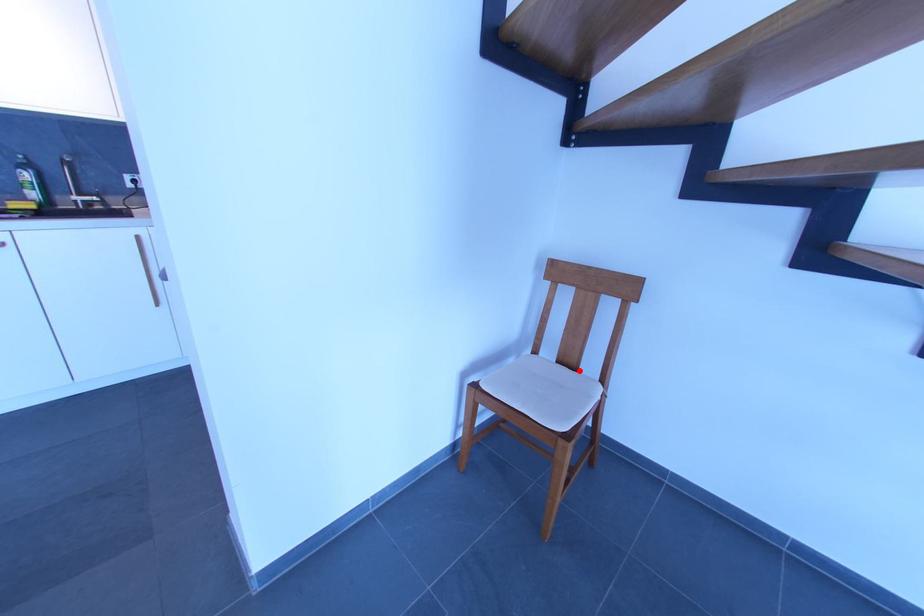
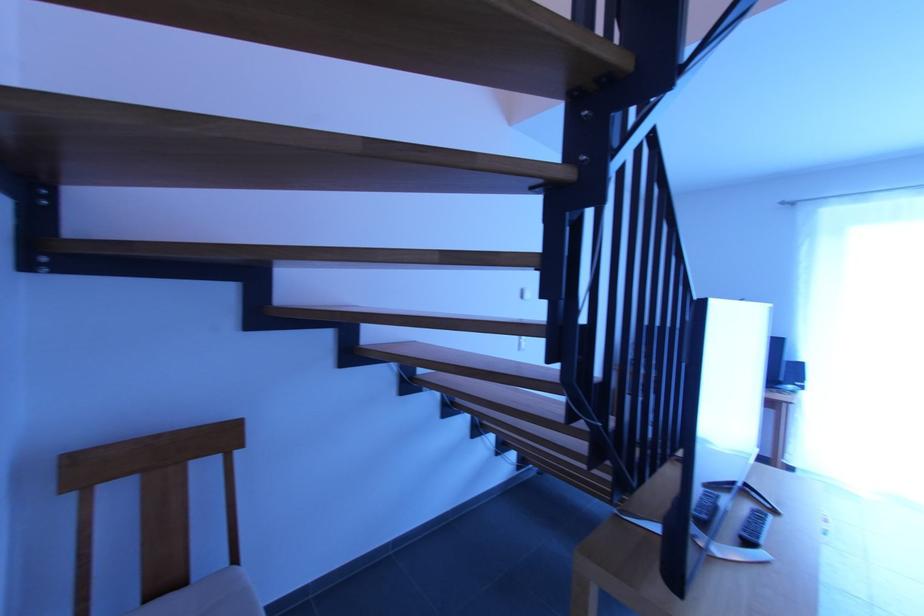
Where in the second image is the point corresponding to the highlighted location from the first image?

(189, 584)